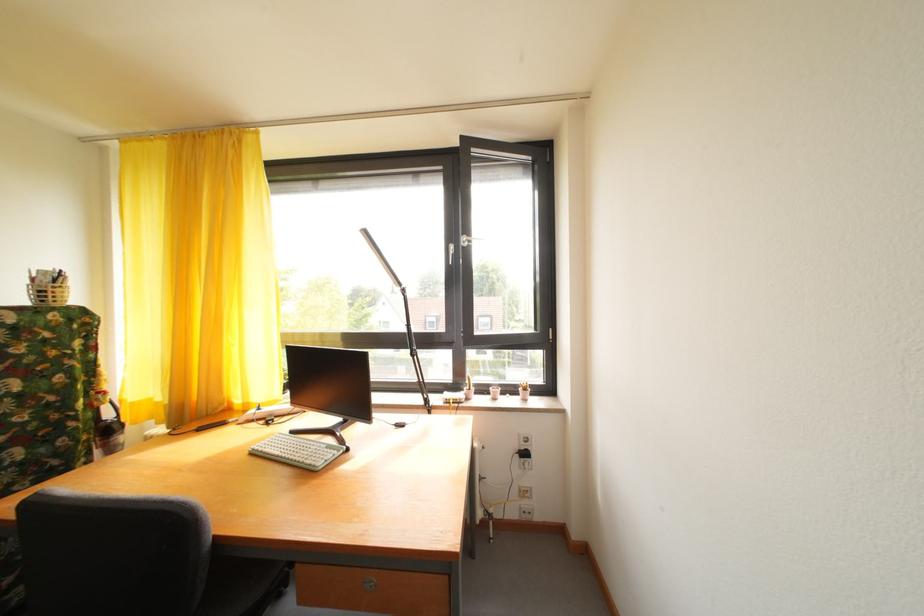
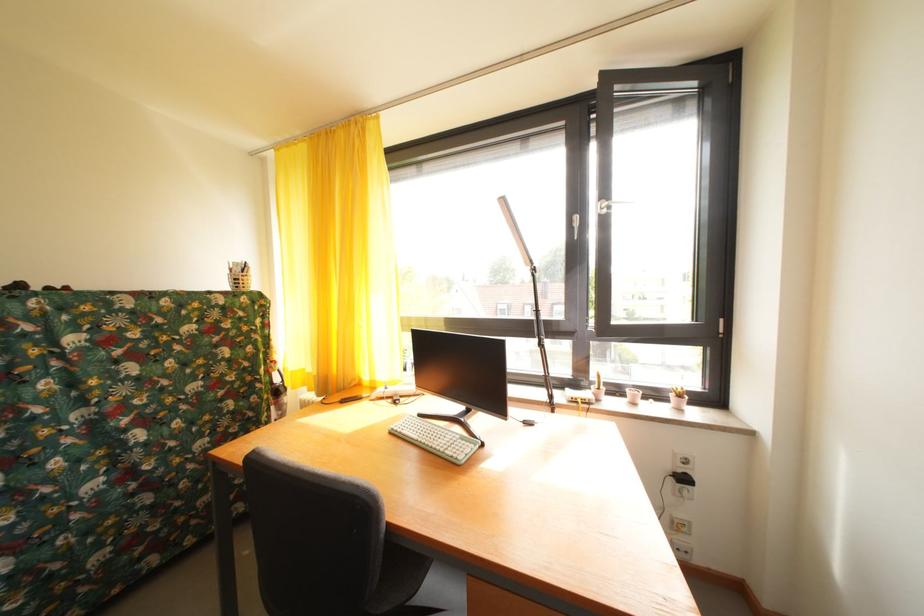
Which direction would the cameraman need to move to produce the second image?

The movement direction of the cameraman is left, forward.